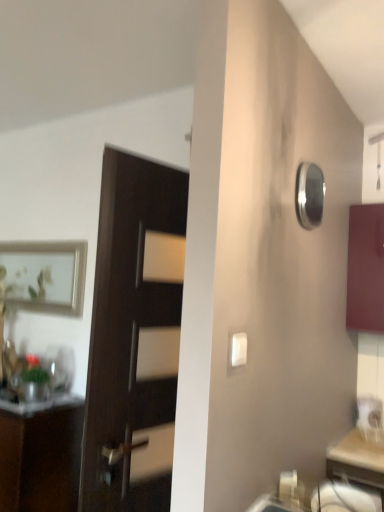
Question: In the image, is dark wood door at center on the left side or the right side of polished silver mirror at upper right?

Choices:
 (A) right
 (B) left

Answer: (B)

Question: In the image, is dark wood door at center positioned in front of or behind polished silver mirror at upper right?

Choices:
 (A) front
 (B) behind

Answer: (A)

Question: Based on their relative distances, which object is farther from the polished silver mirror at upper right?

Choices:
 (A) dark wood door at center
 (B) matte burgundy cabinet at right, which appears as the 1th cabinetry when viewed from the top
 (C) white plastic light switch at center
 (D) matte brown cabinet at left, which is the second cabinetry in right-to-left order
 (E) matte white drawer at lower right

Answer: (D)

Question: Which is nearer to the matte silver picture frame at upper left?

Choices:
 (A) matte brown cabinet at left, marked as the second cabinetry in a top-to-bottom arrangement
 (B) dark wood door at center
 (C) matte white drawer at lower right
 (D) white plastic light switch at center
 (E) polished silver mirror at upper right

Answer: (A)